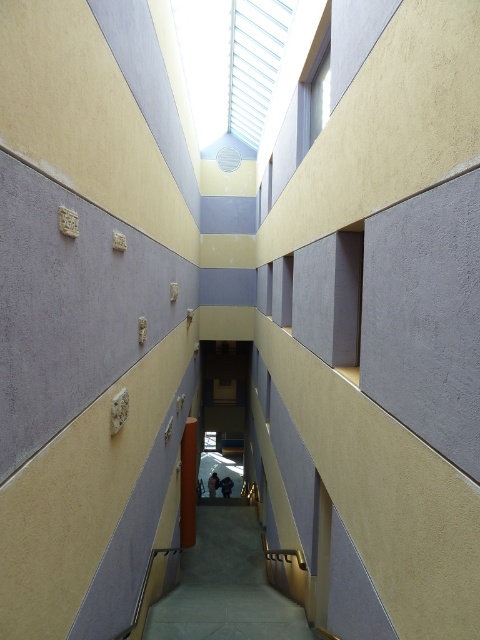
Question: Which object appears closest to the camera in this image?

Choices:
 (A) smooth brown wooden pillar at center
 (B) smooth concrete stairs at center

Answer: (B)

Question: Is smooth concrete stairs at center wider than smooth brown wooden pillar at center?

Choices:
 (A) no
 (B) yes

Answer: (B)

Question: Which object is closer to the camera taking this photo?

Choices:
 (A) smooth concrete stairs at center
 (B) smooth brown wooden pillar at center

Answer: (A)

Question: Where is smooth concrete stairs at center located in relation to smooth brown wooden pillar at center in the image?

Choices:
 (A) above
 (B) below

Answer: (B)

Question: Is smooth concrete stairs at center to the right of smooth brown wooden pillar at center from the viewer's perspective?

Choices:
 (A) yes
 (B) no

Answer: (A)

Question: Among these points, which one is farthest from the camera?

Choices:
 (A) [298, 609]
 (B) [190, 499]

Answer: (B)